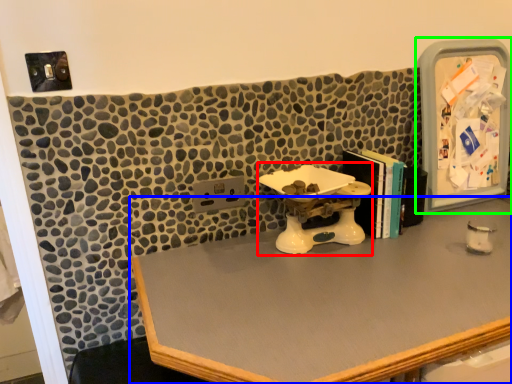
Question: Which object is the closest to the sink (highlighted by a red box)? Choose among these: desk (highlighted by a blue box) or medicine cabinet (highlighted by a green box).

Choices:
 (A) desk
 (B) medicine cabinet

Answer: (A)